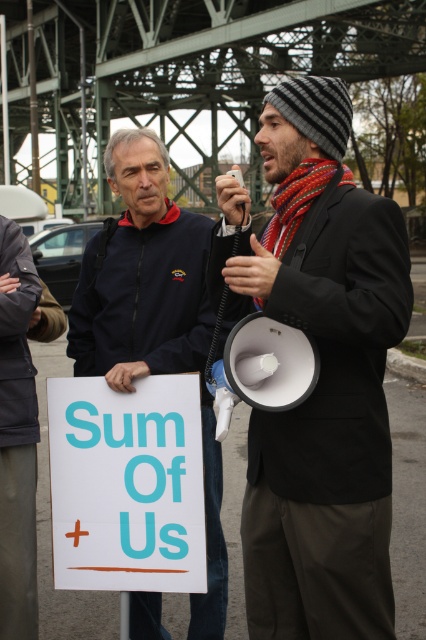
You are a photographer at this event. You want to capture a photo where both the matte black megaphone at center and the dark blue jacket at center are visible. Considering their heights, which object should you focus on to ensure both are in frame?

The matte black megaphone at center is shorter than the dark blue jacket at center. To ensure both are in frame, focus on the dark blue jacket at center since it is taller and will be more visible from a distance.

You are a photographer trying to capture a closeup shot of both the matte black megaphone at center and the white paper sign at center in the scene. The camera you are using has a maximum focus range of 45 centimeters. Can you fit both objects within the camera focus range without moving the camera?

The matte black megaphone at center and white paper sign at center are 44.69 centimeters apart from each other. Since the distance between them is less than the camera maximum focus range of 45 centimeters, you can fit both objects within the camera focus range without moving the camera.

You are standing at the center of the image and want to place a sticker on the matte black megaphone at center. The sticker requires a specific placement at coordinates point (319, 376). Is this point located on the matte black megaphone at center?

Yes, the point (319, 376) is on the matte black megaphone at center, so you can place the sticker there.